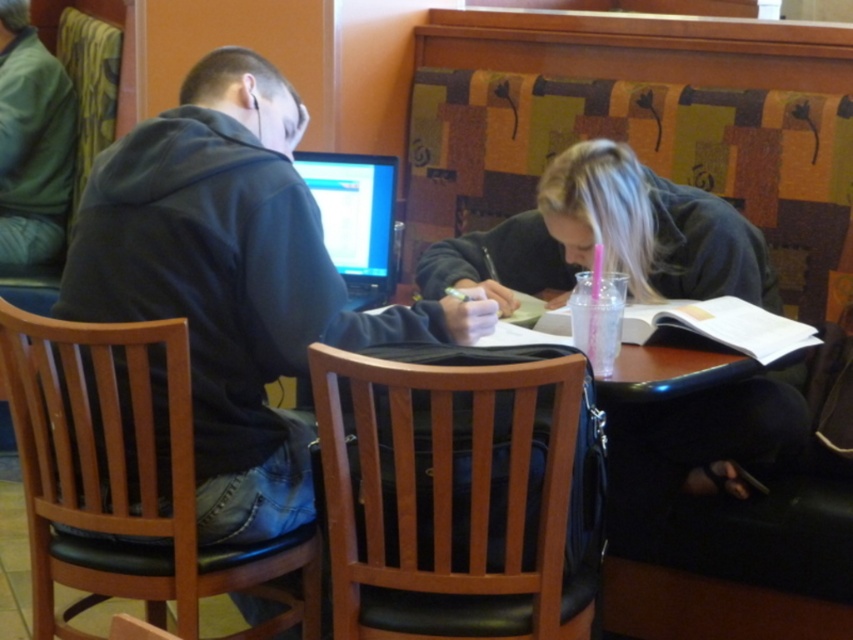
Which is behind, point (282, 220) or point (775, 312)?

Point (775, 312)

Where is `dark blue hoodie at left`? This screenshot has width=853, height=640. dark blue hoodie at left is located at coordinates (231, 280).

Measure the distance between point [270,353] and camera.

Point [270,353] and camera are 5.09 feet apart.

Can you confirm if dark blue hoodie at left is bigger than green fleece hoodie at left?

Correct, dark blue hoodie at left is larger in size than green fleece hoodie at left.

Where is `dark blue hoodie at left`? This screenshot has height=640, width=853. dark blue hoodie at left is located at coordinates (231, 280).

Identify the location of dark gray hoodie at center. (608, 237).

Which is below, dark gray hoodie at center or green fleece hoodie at left?

Positioned lower is dark gray hoodie at center.

Find the location of a particular element. The height and width of the screenshot is (640, 853). dark gray hoodie at center is located at coordinates (608, 237).